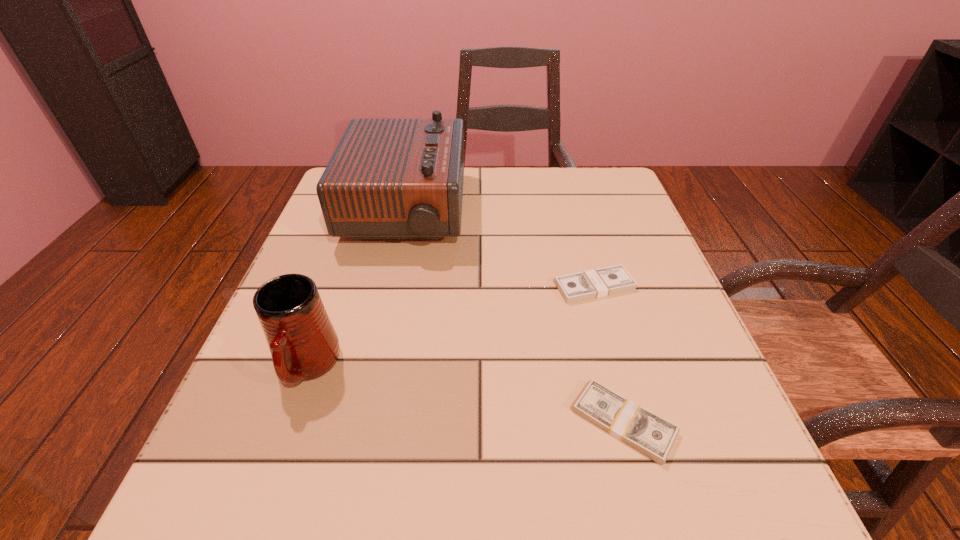
Where is `the tallest object`? The width and height of the screenshot is (960, 540). the tallest object is located at coordinates (388, 178).

Locate an element on the screen. The height and width of the screenshot is (540, 960). radio receiver is located at coordinates (388, 178).

You are a GUI agent. You are given a task and a screenshot of the screen. Output one action in this format:
    pyautogui.click(x=<x>, y=<y>)
    Task: Click on the mug
    The width and height of the screenshot is (960, 540).
    Given the screenshot: What is the action you would take?
    pyautogui.click(x=303, y=343)

The width and height of the screenshot is (960, 540). Find the location of `the farther dollar`. the farther dollar is located at coordinates (606, 281).

Locate an element on the screen. the nearer dollar is located at coordinates (651, 435).

Locate an element on the screen. This screenshot has width=960, height=540. free space located 0.360m on the front panel of the radio receiver is located at coordinates (620, 211).

The width and height of the screenshot is (960, 540). Identify the location of blank space located 0.120m on the side of the mug with the handle. (264, 489).

Where is `free space located on the left of the second farthest object`? The height and width of the screenshot is (540, 960). free space located on the left of the second farthest object is located at coordinates (458, 286).

You are a GUI agent. You are given a task and a screenshot of the screen. Output one action in this format:
    pyautogui.click(x=<x>, y=<y>)
    Task: Click on the vacant space located on the left of the nearer dollar
    
    Given the screenshot: What is the action you would take?
    pyautogui.click(x=530, y=422)

This screenshot has height=540, width=960. I want to click on object positioned at the far edge, so click(388, 178).